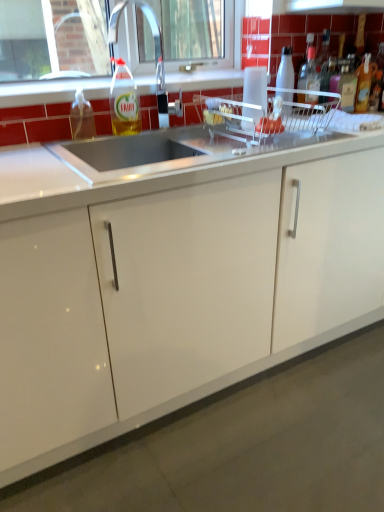
Question: Looking at the image, does clear plastic faucet at upper center seem bigger or smaller compared to satin steel sink at upper center?

Choices:
 (A) small
 (B) big

Answer: (A)

Question: From a real-world perspective, is clear plastic faucet at upper center above or below satin steel sink at upper center?

Choices:
 (A) below
 (B) above

Answer: (B)

Question: Estimate the real-world distances between objects in this image. Which object is closer to the white glossy countertop at center, which appears as the 1th countertop when viewed from the top?

Choices:
 (A) satin steel sink at upper center
 (B) translucent plastic bottle at upper right, the second bottle positioned from the right
 (C) clear glass window at upper center
 (D) translucent plastic container at upper center
 (E) translucent plastic soap dispenser at sink left, the sixth bottle in the right-to-left sequence

Answer: (A)

Question: Based on their relative distances, which object is farther from the satin steel sink at upper center?

Choices:
 (A) translucent plastic bottle at right, the sixth bottle from the left
 (B) translucent plastic bottle at upper right, which is the 4th bottle from left to right
 (C) translucent plastic bottle at upper right, the second bottle positioned from the right
 (D) translucent plastic soap dispenser at sink left, which appears as the 1th bottle when viewed from the left
 (E) translucent plastic bottle at upper center, which is counted as the second bottle, starting from the left

Answer: (A)